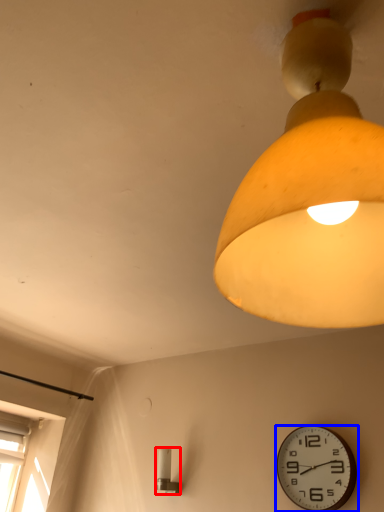
Question: Which of the following is the farthest to the observer, lamp (highlighted by a red box) or wall clock (highlighted by a blue box)?

Choices:
 (A) lamp
 (B) wall clock

Answer: (A)